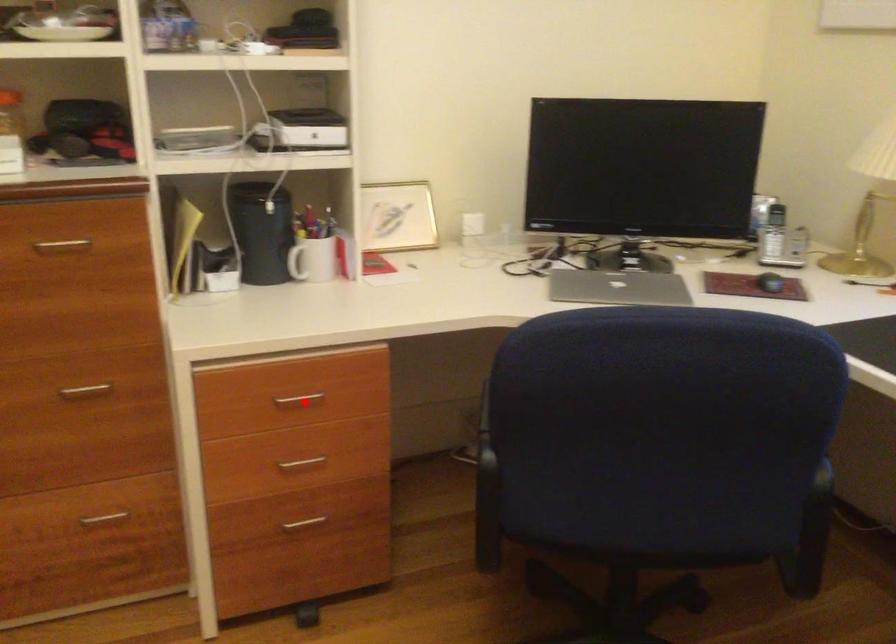
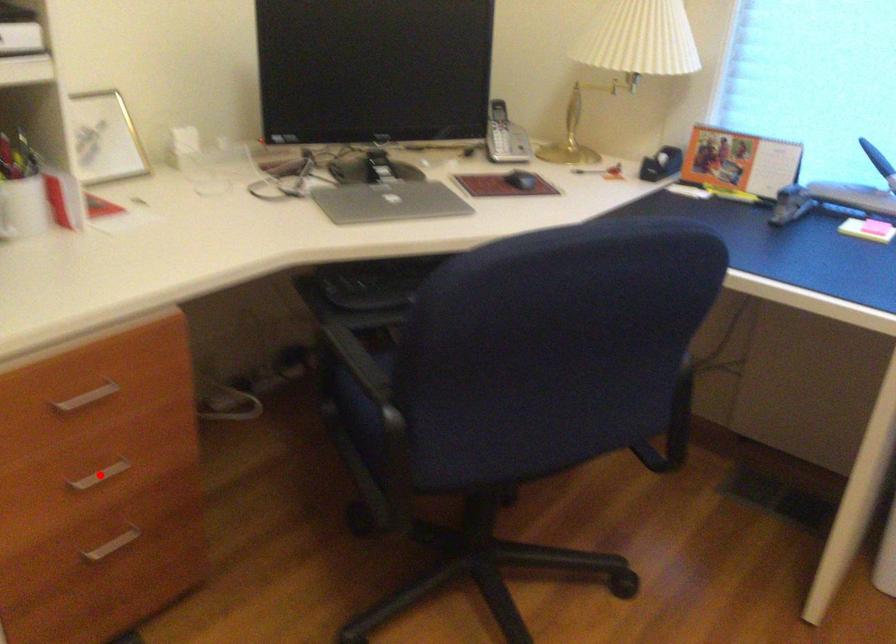
I am providing you with two images of the same scene from different viewpoints. A red point is marked on the first image and another point is marked on the second image. Is the marked point in image1 the same physical position as the marked point in image2?

No